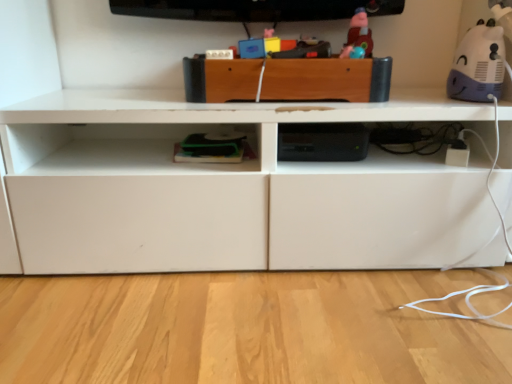
Question: Can you confirm if matte plastic toy at upper center, which ranks as the 2th toy in right-to-left order, is smaller than wooden drawer at center?

Choices:
 (A) no
 (B) yes

Answer: (B)

Question: Is matte plastic toy at upper center, marked as the first toy in a left-to-right arrangement, in front of wooden drawer at center?

Choices:
 (A) no
 (B) yes

Answer: (A)

Question: Is matte plastic toy at upper center, marked as the first toy in a left-to-right arrangement, positioned behind wooden drawer at center?

Choices:
 (A) yes
 (B) no

Answer: (A)

Question: Is matte plastic toy at upper center, which ranks as the 2th toy in right-to-left order, thinner than wooden drawer at center?

Choices:
 (A) no
 (B) yes

Answer: (B)

Question: Considering the relative sizes of matte plastic toy at upper center, which ranks as the 2th toy in right-to-left order, and wooden drawer at center in the image provided, is matte plastic toy at upper center, which ranks as the 2th toy in right-to-left order, bigger than wooden drawer at center?

Choices:
 (A) no
 (B) yes

Answer: (A)

Question: From the image's perspective, relative to purple matte plush toy at upper right, the 1th toy positioned from the right, is wooden drawer at center above or below?

Choices:
 (A) below
 (B) above

Answer: (A)

Question: Is point (340, 66) closer or farther from the camera than point (492, 54)?

Choices:
 (A) closer
 (B) farther

Answer: (A)

Question: From a real-world perspective, is wooden drawer at center above or below purple matte plush toy at upper right, the 1th toy positioned from the right?

Choices:
 (A) below
 (B) above

Answer: (A)

Question: Is wooden drawer at center bigger or smaller than purple matte plush toy at upper right, the 1th toy positioned from the right?

Choices:
 (A) big
 (B) small

Answer: (A)

Question: Is purple matte plush toy at upper right, the 1th toy positioned from the right, bigger or smaller than wooden drawer at center?

Choices:
 (A) big
 (B) small

Answer: (B)

Question: Is purple matte plush toy at upper right, the 2th toy in the left-to-right sequence, in front of or behind wooden drawer at center in the image?

Choices:
 (A) behind
 (B) front

Answer: (B)

Question: Choose the correct answer: Is purple matte plush toy at upper right, the 2th toy in the left-to-right sequence, inside wooden drawer at center or outside it?

Choices:
 (A) outside
 (B) inside

Answer: (A)

Question: In terms of height, does purple matte plush toy at upper right, the 2th toy in the left-to-right sequence, look taller or shorter compared to wooden drawer at center?

Choices:
 (A) short
 (B) tall

Answer: (B)

Question: From their relative heights in the image, would you say wooden drawer at center is taller or shorter than matte plastic toy at upper center, marked as the first toy in a left-to-right arrangement?

Choices:
 (A) tall
 (B) short

Answer: (B)

Question: From a real-world perspective, is wooden drawer at center physically located above or below matte plastic toy at upper center, marked as the first toy in a left-to-right arrangement?

Choices:
 (A) above
 (B) below

Answer: (B)